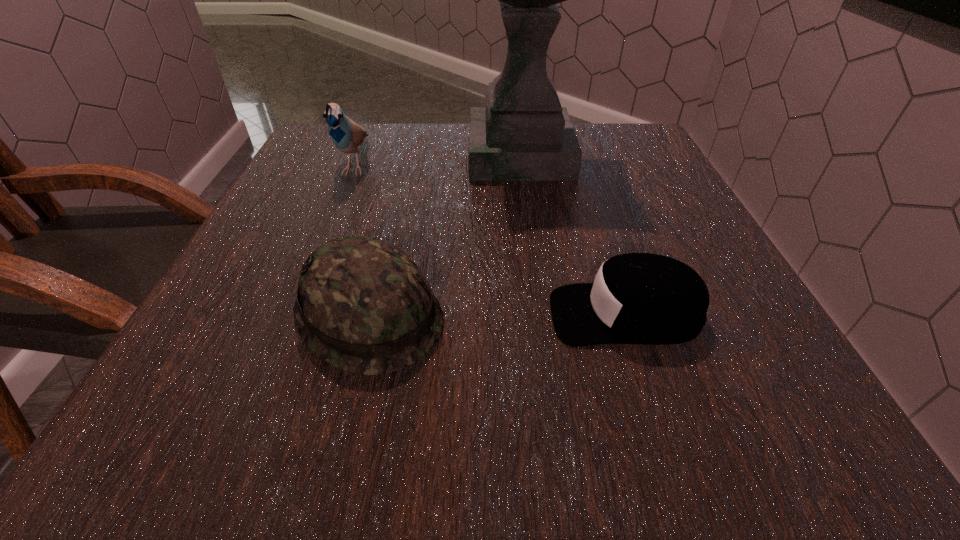
This screenshot has height=540, width=960. I want to click on unoccupied area between the bird and the tallest object, so click(x=438, y=159).

Locate an element on the screen. Image resolution: width=960 pixels, height=540 pixels. empty space between the third tallest object and the shortest object is located at coordinates (497, 315).

The height and width of the screenshot is (540, 960). I want to click on free space between the sculpture and the right cap, so click(572, 234).

At what (x,y) coordinates should I click in order to perform the action: click on free spot between the tallest object and the second tallest object. Please return your answer as a coordinate pair (x, y). Looking at the image, I should click on (438, 159).

Where is `empty space that is in between the shortest object and the sculpture`? empty space that is in between the shortest object and the sculpture is located at coordinates (572, 234).

At what (x,y) coordinates should I click in order to perform the action: click on object that ranks as the second closest to the right cap. Please return your answer as a coordinate pair (x, y). The height and width of the screenshot is (540, 960). Looking at the image, I should click on (522, 134).

This screenshot has width=960, height=540. Find the location of `object that is the third closest to the bird`. object that is the third closest to the bird is located at coordinates (637, 298).

Locate an element on the screen. The width and height of the screenshot is (960, 540). vacant space that satisfies the following two spatial constraints: 1. at the front opening of the tallest object; 2. at the face of the bird is located at coordinates (521, 164).

Locate an element on the screen. vacant region that satisfies the following two spatial constraints: 1. at the face of the third shortest object; 2. on the right side of the left cap is located at coordinates (294, 315).

The width and height of the screenshot is (960, 540). I want to click on vacant area in the image that satisfies the following two spatial constraints: 1. at the front opening of the tallest object; 2. at the face of the second tallest object, so click(521, 164).